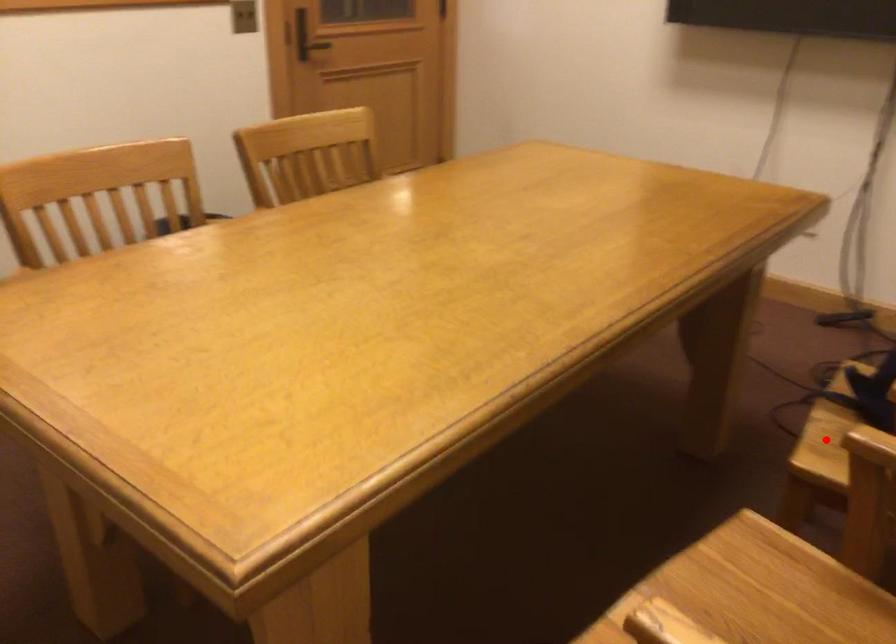
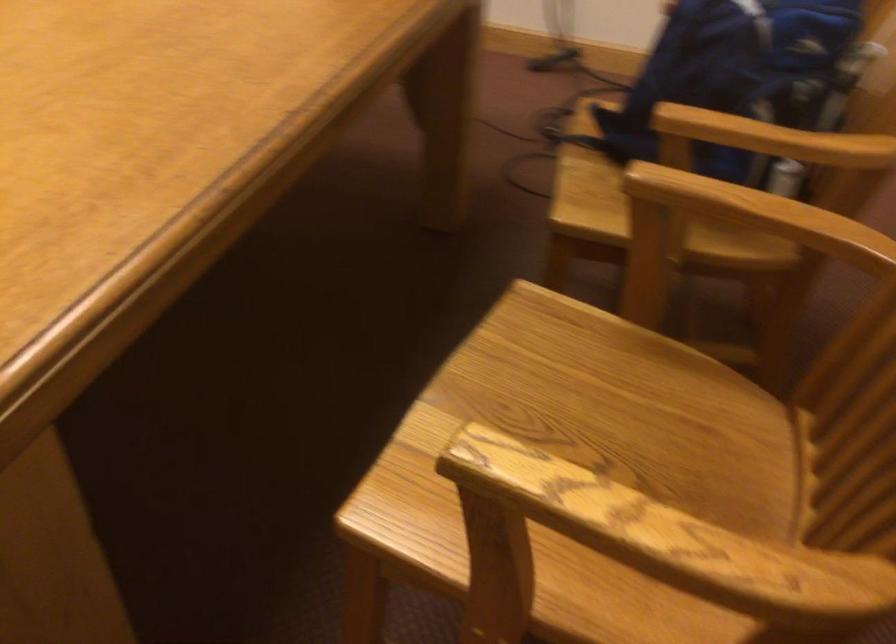
Where in the second image is the point corresponding to the highlighted location from the first image?

(584, 187)